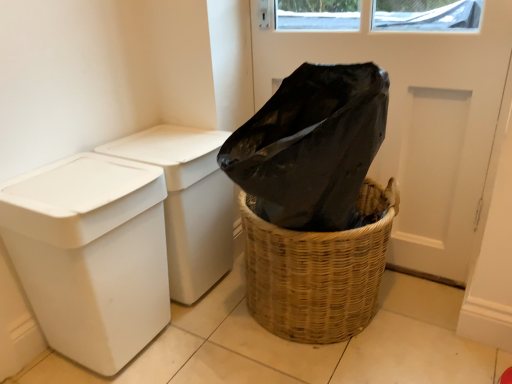
Question: From the image's perspective, is woven brown basket at lower right over white plastic bin at left, which is the 2th waste container from front to back?

Choices:
 (A) no
 (B) yes

Answer: (A)

Question: Is woven brown basket at lower right not inside white plastic bin at left, which is the 2th waste container from front to back?

Choices:
 (A) yes
 (B) no

Answer: (A)

Question: Is white plastic bin at left, marked as the 1th waste container in a back-to-front arrangement, located within woven brown basket at lower right?

Choices:
 (A) no
 (B) yes

Answer: (A)

Question: Considering the relative sizes of woven brown basket at lower right and white plastic bin at left, marked as the 1th waste container in a back-to-front arrangement, in the image provided, is woven brown basket at lower right bigger than white plastic bin at left, marked as the 1th waste container in a back-to-front arrangement,?

Choices:
 (A) no
 (B) yes

Answer: (B)

Question: Can you confirm if woven brown basket at lower right is smaller than white plastic bin at left, which is the 2th waste container from front to back?

Choices:
 (A) yes
 (B) no

Answer: (B)

Question: From a real-world perspective, relative to black plastic screen door at upper center, is white plastic bin at left, marked as the 1th waste container in a back-to-front arrangement, vertically above or below?

Choices:
 (A) below
 (B) above

Answer: (A)

Question: Considering the positions of white plastic bin at left, which is the 2th waste container from front to back, and black plastic screen door at upper center in the image, is white plastic bin at left, which is the 2th waste container from front to back, bigger or smaller than black plastic screen door at upper center?

Choices:
 (A) small
 (B) big

Answer: (A)

Question: Would you say white plastic bin at left, which is the 2th waste container from front to back, is to the left or to the right of black plastic screen door at upper center in the picture?

Choices:
 (A) right
 (B) left

Answer: (B)

Question: Considering the positions of white plastic bin at left, which is the 2th waste container from front to back, and black plastic screen door at upper center in the image, is white plastic bin at left, which is the 2th waste container from front to back, wider or thinner than black plastic screen door at upper center?

Choices:
 (A) wide
 (B) thin

Answer: (A)

Question: Is woven brown basket at lower right bigger or smaller than white plastic bin at left, which is counted as the second waste container, starting from the back?

Choices:
 (A) big
 (B) small

Answer: (A)

Question: Relative to white plastic bin at left, which is the 1th waste container in front-to-back order, is woven brown basket at lower right in front or behind?

Choices:
 (A) behind
 (B) front

Answer: (A)

Question: Does point (280, 306) appear closer or farther from the camera than point (84, 152)?

Choices:
 (A) closer
 (B) farther

Answer: (A)

Question: From the image's perspective, relative to white plastic bin at left, which is counted as the second waste container, starting from the back, is woven brown basket at lower right above or below?

Choices:
 (A) above
 (B) below

Answer: (A)

Question: Does point (96, 337) appear closer or farther from the camera than point (402, 238)?

Choices:
 (A) closer
 (B) farther

Answer: (A)

Question: Which is correct: white plastic bin at left, which is counted as the second waste container, starting from the back, is inside black plastic screen door at upper center, or outside of it?

Choices:
 (A) inside
 (B) outside

Answer: (B)